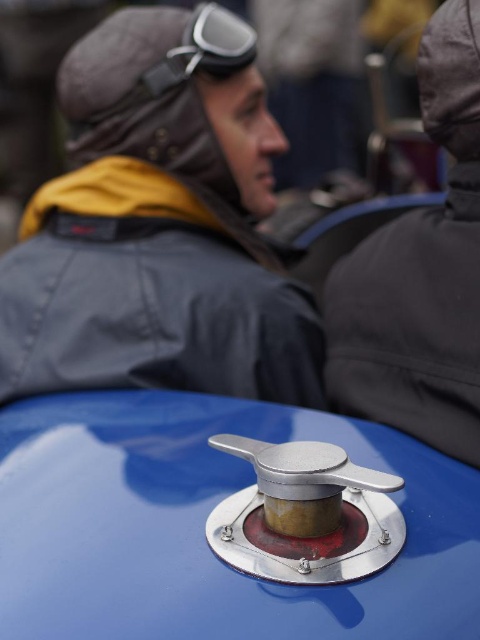
You are a mechanic working on a vintage aircraft. You need to adjust the shiny metallic knob at center and the matte gray goggles at upper center. Which object is easier to reach without moving your position?

The shiny metallic knob at center is closer to the viewer than the matte gray goggles at upper center, so it is easier to reach without moving your position.

You are a mechanic working on a vintage aircraft and need to reach the shiny metallic knob at center while wearing the dark gray jacket at center. Can you comfortably reach the knob without moving your position?

The shiny metallic knob at center is 14.36 inches from the dark gray jacket at center, so yes, you can comfortably reach the knob without moving your position as the distance is within typical comfortable reach range.

Looking at this image, you are a mechanic working on a vintage aircraft. You need to reach the shiny metallic knob at center to adjust it. If your hand can extend 60 centimeters, will you be able to reach it?

The shiny metallic knob at center is 66.97 centimeters away from the camera. Since your hand can only extend 60 centimeters, you will not be able to reach it.